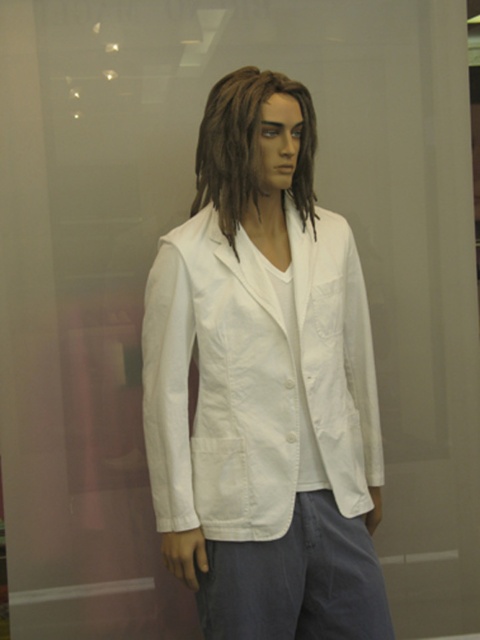
Question: Is white cotton lab coat at center closer to camera compared to denim pants at lower center?

Choices:
 (A) yes
 (B) no

Answer: (B)

Question: Does white cotton lab coat at center have a smaller size compared to brownhair at center?

Choices:
 (A) no
 (B) yes

Answer: (A)

Question: Which point is farther to the camera?

Choices:
 (A) [x=201, y=276]
 (B) [x=239, y=179]

Answer: (B)

Question: Where is white cotton lab coat at center located in relation to denim pants at lower center in the image?

Choices:
 (A) below
 (B) above

Answer: (B)

Question: Which is nearer to the denim pants at lower center?

Choices:
 (A) brownhair at center
 (B) white cotton lab coat at center

Answer: (B)

Question: Which of the following is the closest to the observer?

Choices:
 (A) denim pants at lower center
 (B) brownhair at center

Answer: (A)